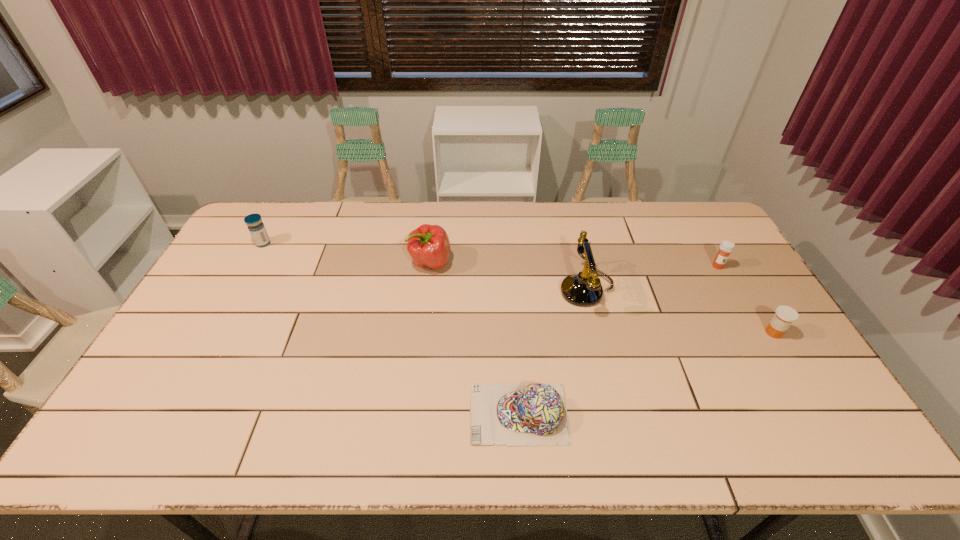
The width and height of the screenshot is (960, 540). Find the location of `empty space that is in between the fifth object from right to left and the second medicine from right to left`. empty space that is in between the fifth object from right to left and the second medicine from right to left is located at coordinates (574, 264).

The width and height of the screenshot is (960, 540). I want to click on vacant space that's between the telephone and the nearest object, so click(x=553, y=352).

The width and height of the screenshot is (960, 540). Identify the location of object that stands as the closest to the second object from left to right. (582, 289).

In order to click on the closest object relative to the farthest medicine in this screenshot , I will do `click(429, 246)`.

You are a GUI agent. You are given a task and a screenshot of the screen. Output one action in this format:
    pyautogui.click(x=<x>, y=<y>)
    Task: Click on the medicine that is the closest to the pepper
    This screenshot has height=540, width=960.
    Given the screenshot: What is the action you would take?
    pyautogui.click(x=256, y=227)

In order to click on medicine that is the third closest to the telephone in this screenshot , I will do `click(256, 227)`.

Identify the location of free space that satisfies the following two spatial constraints: 1. on the label side of the second medicine from right to left; 2. on the dial of the third object from right to left. (732, 290).